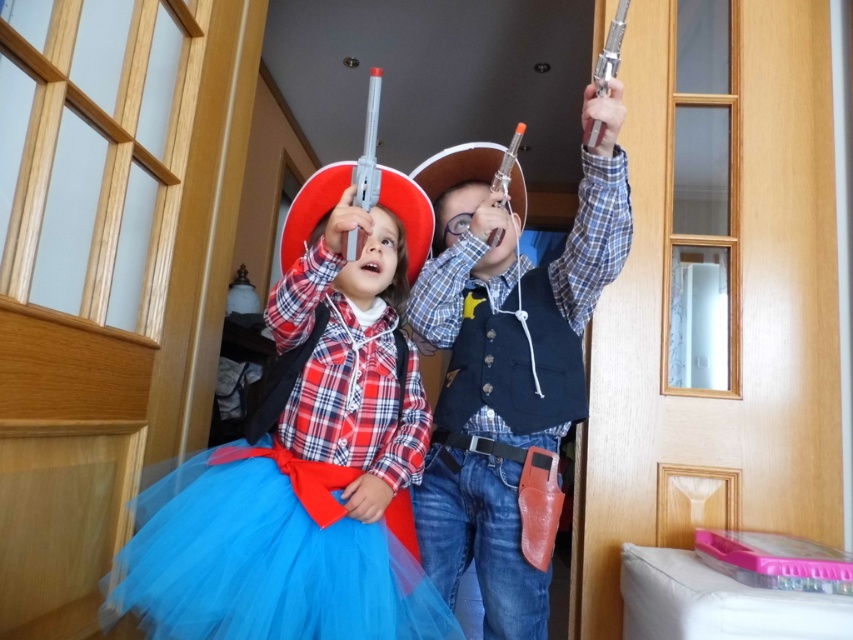
Is point (498, 456) positioned in front of point (308, 538)?

That is False.

Is matte plastic toy gun at center wider than blue tulle ballet skirt at lower center?

No, matte plastic toy gun at center is not wider than blue tulle ballet skirt at lower center.

Is point (576, 300) less distant than point (372, 625)?

That is False.

Locate an element on the screen. This screenshot has width=853, height=640. matte plastic toy gun at center is located at coordinates (508, 369).

Measure the distance between point (x=206, y=572) and camera.

They are 96.14 centimeters apart.

Does matte red cowboy hat at upper center come in front of blue tulle ballet skirt at lower center?

No, it is not.

The height and width of the screenshot is (640, 853). What are the coordinates of `matte red cowboy hat at upper center` in the screenshot? It's located at (306, 456).

The width and height of the screenshot is (853, 640). Find the location of `matte red cowboy hat at upper center`. matte red cowboy hat at upper center is located at coordinates (306, 456).

Is point (258, 449) more distant than point (506, 369)?

No, it is in front of (506, 369).

Does matte red cowboy hat at upper center appear on the right side of matte plastic toy gun at center?

Incorrect, matte red cowboy hat at upper center is not on the right side of matte plastic toy gun at center.

Describe the element at coordinates (306, 456) in the screenshot. The height and width of the screenshot is (640, 853). I see `matte red cowboy hat at upper center` at that location.

In order to click on matte red cowboy hat at upper center in this screenshot , I will do `click(306, 456)`.